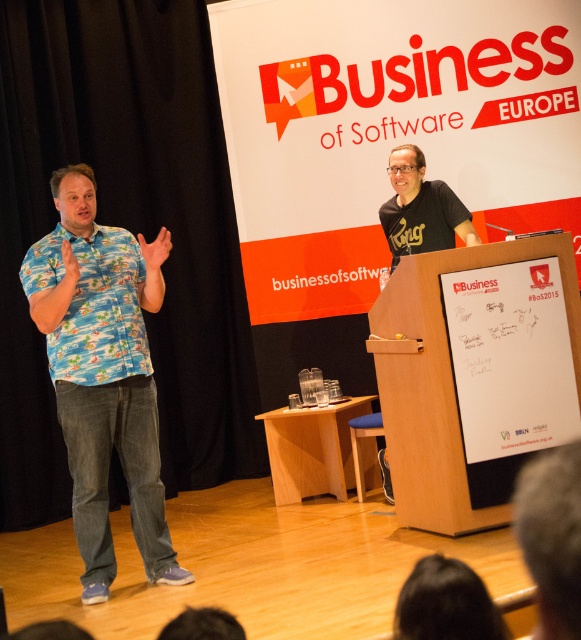
You are attending the Business of Software Europe conference and notice two items of interest in the image provided. The blue floral shirt at left and the light wood podium at center. Based on their positions, which one is higher up in the image?

The blue floral shirt at left is above the light wood podium at center, so the blue floral shirt at left is higher up in the image.

You are attending the Business of Software Europe conference and notice two items of interest in the image provided. The first is a man wearing a blue floral shirt at left, and the second is a light wood podium at center. From your vantage point, which of these two items appears taller?

The blue floral shirt at left is taller than the light wood podium at center.